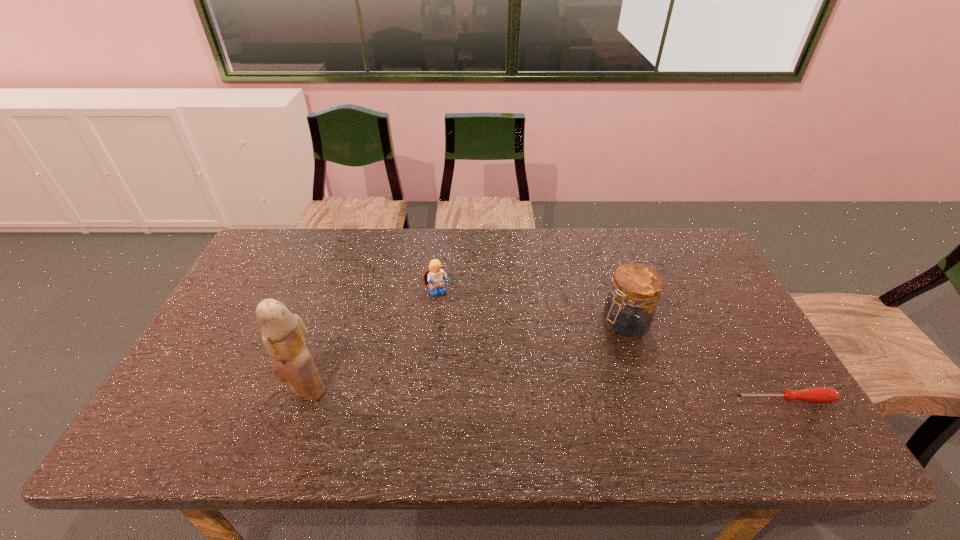
I want to click on object that is at the near right corner, so click(816, 394).

What are the coordinates of `free point at the far edge` in the screenshot? It's located at (602, 232).

The image size is (960, 540). In the image, there is a desktop. Find the location of `vacant space at the near edge`. vacant space at the near edge is located at coordinates (634, 396).

Locate an element on the screen. This screenshot has width=960, height=540. vacant space at the left edge is located at coordinates (236, 367).

Where is `free point at the far right corner`? This screenshot has width=960, height=540. free point at the far right corner is located at coordinates (676, 252).

In the image, there is a desktop. Identify the location of vacant space at the near right corner. The width and height of the screenshot is (960, 540). (732, 394).

This screenshot has width=960, height=540. Find the location of `free space between the figurine and the jar`. free space between the figurine and the jar is located at coordinates (465, 357).

Locate an element on the screen. This screenshot has height=540, width=960. free spot between the leftmost object and the third nearest object is located at coordinates (465, 357).

The width and height of the screenshot is (960, 540). Find the location of `free space between the second shortest object and the third shortest object`. free space between the second shortest object and the third shortest object is located at coordinates (531, 309).

Where is `free space between the third object from left to right and the third tallest object`? Image resolution: width=960 pixels, height=540 pixels. free space between the third object from left to right and the third tallest object is located at coordinates (531, 309).